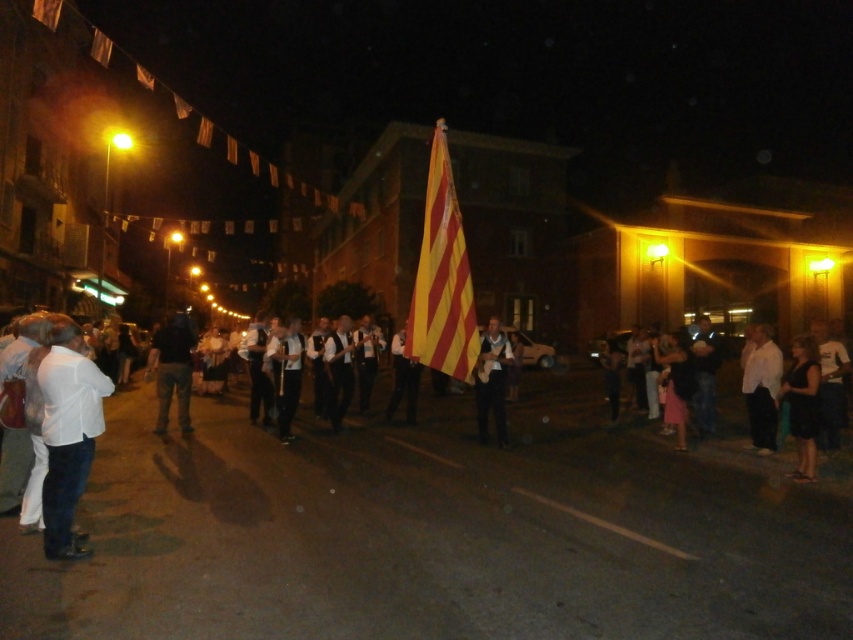
In the scene shown: You are standing on the street watching the nighttime parade. You notice a black fabric dress at lower right. Can you reach out and touch it from where you are standing?

The black fabric dress at lower right is 9.17 meters away from viewer, so you cannot reach it from where you are standing.